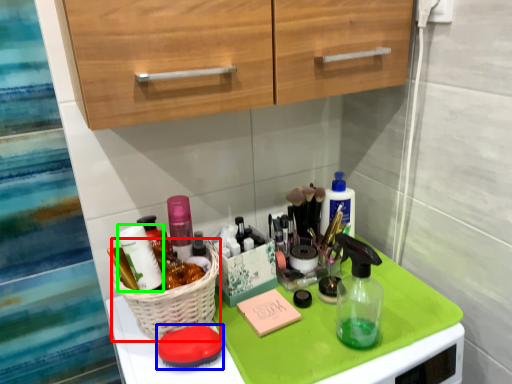
Question: Considering the real-world distances, which object is farthest from basket (highlighted by a red box)? soap (highlighted by a blue box) or toiletry (highlighted by a green box)?

Choices:
 (A) soap
 (B) toiletry

Answer: (B)